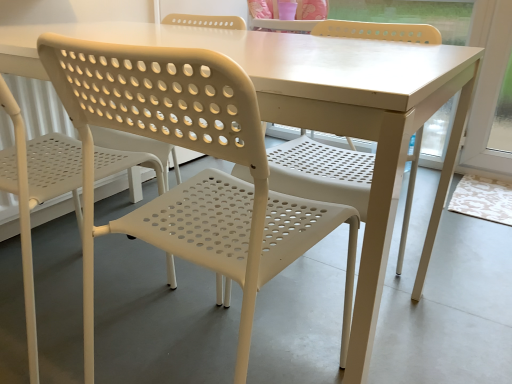
Locate an element on the screen. This screenshot has height=384, width=512. vacant space underneath white plastic chair at center, which appears as the first chair when viewed from the right (from a real-world perspective) is located at coordinates (234, 353).